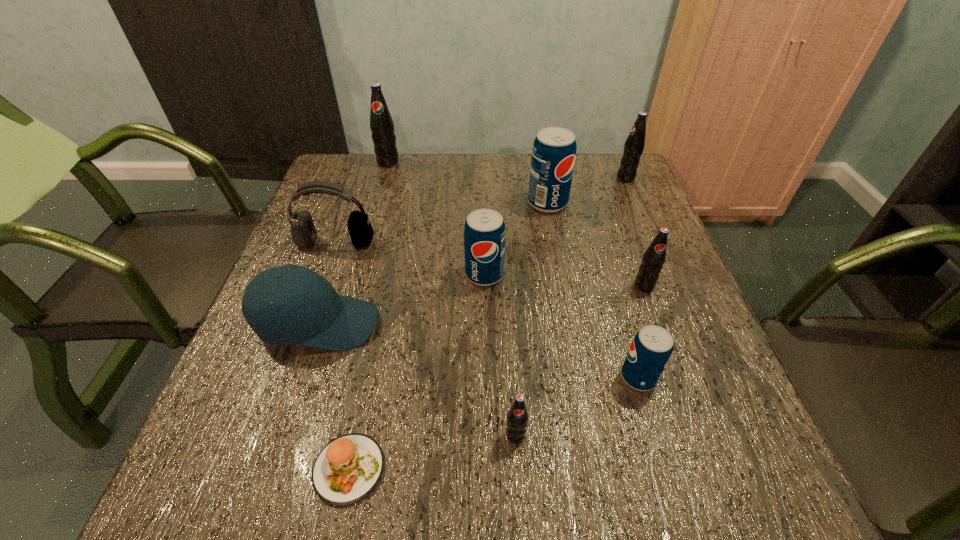
Where is `the third black pop from left to right`? The width and height of the screenshot is (960, 540). the third black pop from left to right is located at coordinates (654, 257).

You are a GUI agent. You are given a task and a screenshot of the screen. Output one action in this format:
    pyautogui.click(x=<x>, y=<y>)
    Task: Click on the sixth pop from left to right
    
    Given the screenshot: What is the action you would take?
    pyautogui.click(x=654, y=257)

The image size is (960, 540). Find the location of `baseball cap`. baseball cap is located at coordinates (320, 318).

The width and height of the screenshot is (960, 540). In order to click on the fourth nearest object in this screenshot , I will do `click(320, 318)`.

The height and width of the screenshot is (540, 960). In order to click on the rightmost blue pop in this screenshot , I will do `click(651, 349)`.

Find the location of a particular element. The width and height of the screenshot is (960, 540). the smallest blue pop is located at coordinates (651, 349).

You are a GUI agent. You are given a task and a screenshot of the screen. Output one action in this format:
    pyautogui.click(x=<x>, y=<y>)
    Task: Click on the smallest black pop
    This screenshot has width=960, height=540.
    Given the screenshot: What is the action you would take?
    (x=517, y=417)

Identify the location of the nearest black pop. The image size is (960, 540). (517, 417).

Identify the location of patty. (347, 469).

In order to click on free region located 0.150m on the front label of the farthest black pop in this screenshot , I will do `click(378, 197)`.